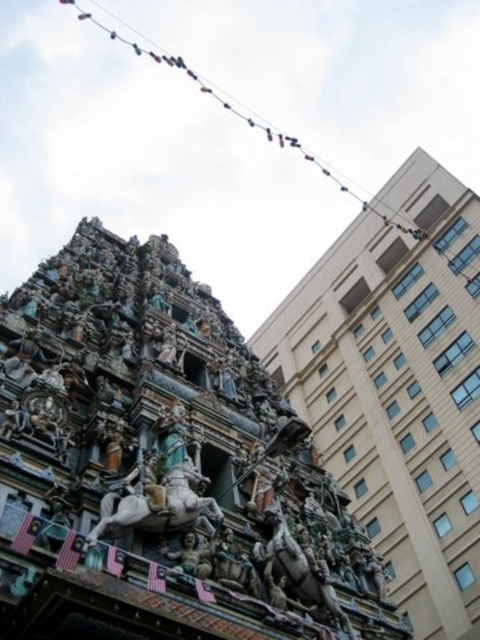
In the scene shown: Who is shorter, carved stone hindu temple at center or polished bronze horse at center?

polished bronze horse at center is shorter.

Between carved stone hindu temple at center and polished bronze horse at center, which one is positioned lower?

polished bronze horse at center is lower down.

Who is more distant from viewer, (x=429, y=358) or (x=181, y=502)?

The point (x=429, y=358) is behind.

Find the location of a particular element. Image resolution: width=480 pixels, height=640 pixels. carved stone hindu temple at center is located at coordinates (397, 385).